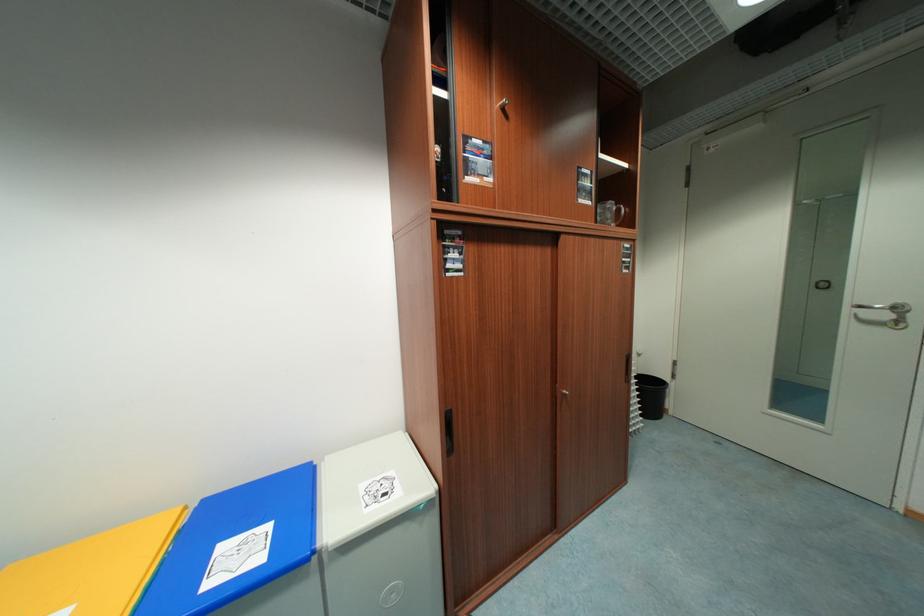
You are a GUI agent. You are given a task and a screenshot of the screen. Output one action in this format:
    pyautogui.click(x=<x>, y=<y>)
    Task: Click on the silver door handle
    
    Given the screenshot: What is the action you would take?
    pos(882,306)